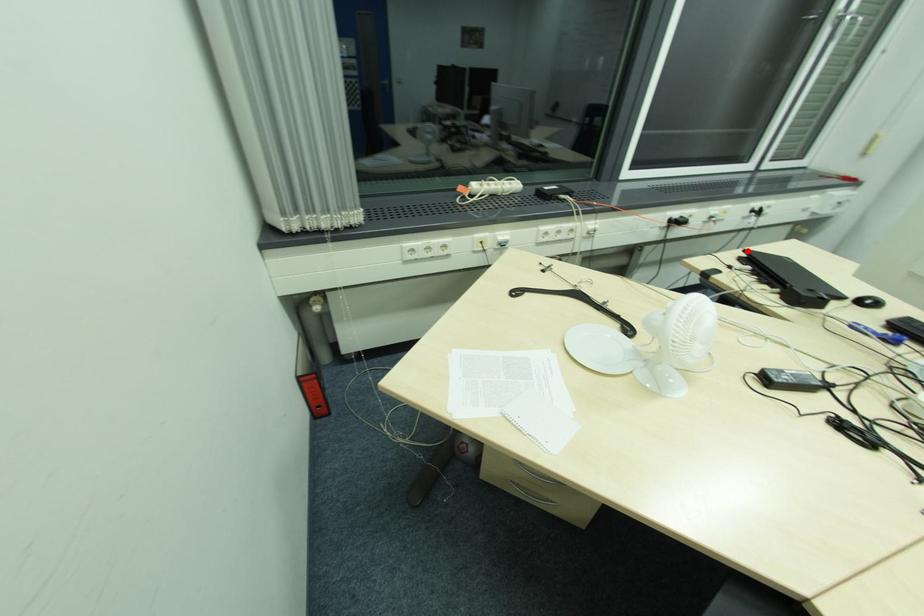
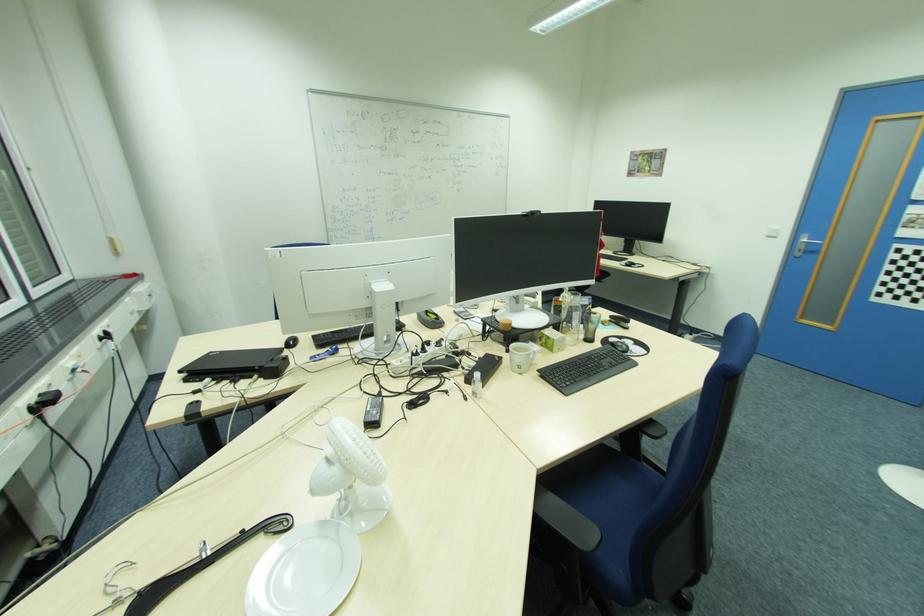
Question: I am providing you with two images of the same scene from different viewpoints. A red point is marked on the first image. Is the red point's position out of view in image 2?

Choices:
 (A) Yes
 (B) No

Answer: (B)